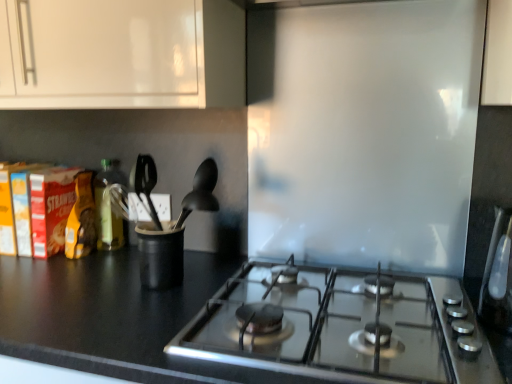
Question: Does satin silver toaster at right have a lesser width compared to green glass bottle at left?

Choices:
 (A) yes
 (B) no

Answer: (B)

Question: Is satin silver toaster at right positioned with its back to green glass bottle at left?

Choices:
 (A) no
 (B) yes

Answer: (A)

Question: Considering the relative sizes of satin silver toaster at right and green glass bottle at left in the image provided, is satin silver toaster at right bigger than green glass bottle at left?

Choices:
 (A) yes
 (B) no

Answer: (A)

Question: Considering the relative sizes of satin silver toaster at right and green glass bottle at left in the image provided, is satin silver toaster at right taller than green glass bottle at left?

Choices:
 (A) no
 (B) yes

Answer: (A)

Question: Is satin silver toaster at right closer to camera compared to green glass bottle at left?

Choices:
 (A) no
 (B) yes

Answer: (B)

Question: Looking at their shapes, would you say green glass bottle at left is wider or thinner than black matte countertop at lower left?

Choices:
 (A) wide
 (B) thin

Answer: (B)

Question: Is point (104, 220) positioned closer to the camera than point (151, 349)?

Choices:
 (A) farther
 (B) closer

Answer: (A)

Question: Considering the relative positions of green glass bottle at left and black matte countertop at lower left in the image provided, is green glass bottle at left to the left or to the right of black matte countertop at lower left?

Choices:
 (A) left
 (B) right

Answer: (A)

Question: From a real-world perspective, is green glass bottle at left positioned above or below black matte countertop at lower left?

Choices:
 (A) above
 (B) below

Answer: (A)

Question: From a real-world perspective, is satin silver toaster at right positioned above or below black plastic utensil holder at center?

Choices:
 (A) above
 (B) below

Answer: (A)

Question: Is point (504, 251) positioned closer to the camera than point (147, 259)?

Choices:
 (A) closer
 (B) farther

Answer: (A)

Question: Looking at the image, does satin silver toaster at right seem bigger or smaller compared to black plastic utensil holder at center?

Choices:
 (A) big
 (B) small

Answer: (A)

Question: Visually, is satin silver toaster at right positioned to the left or to the right of black plastic utensil holder at center?

Choices:
 (A) left
 (B) right

Answer: (B)

Question: From the image's perspective, relative to white glossy cabinet at upper left, is black matte countertop at lower left above or below?

Choices:
 (A) above
 (B) below

Answer: (B)

Question: Does point (59, 312) appear closer or farther from the camera than point (144, 14)?

Choices:
 (A) closer
 (B) farther

Answer: (A)